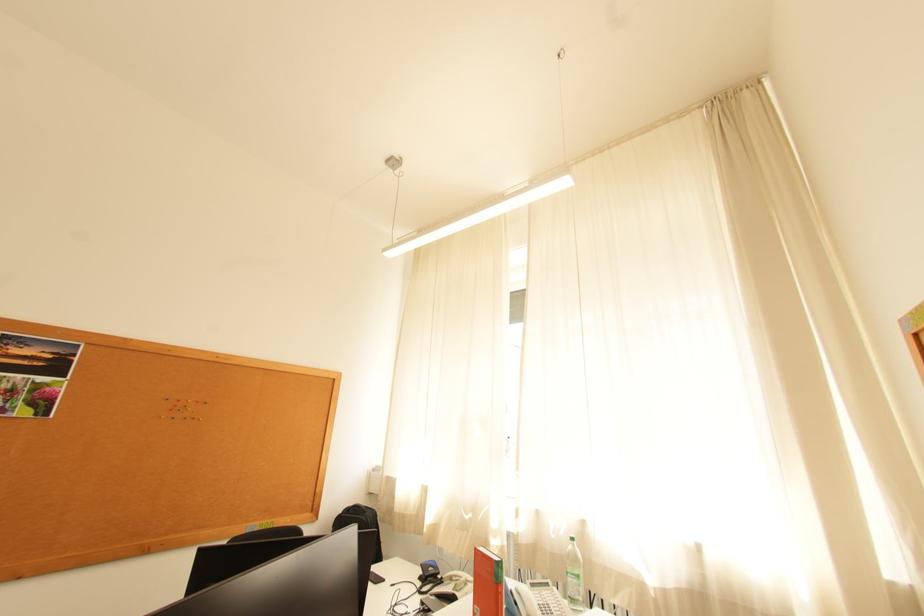
In order to click on telephone button in this screenshot , I will do `click(429, 570)`.